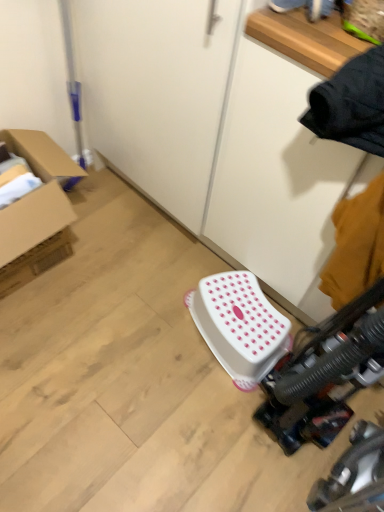
Question: Is white plastic stool at center at the back of cardboard box at left?

Choices:
 (A) yes
 (B) no

Answer: (B)

Question: Is the surface of cardboard box at left in direct contact with white plastic stool at center?

Choices:
 (A) no
 (B) yes

Answer: (A)

Question: Would you say white plastic stool at center is part of cardboard box at left's contents?

Choices:
 (A) yes
 (B) no

Answer: (B)

Question: Is cardboard box at left further to camera compared to white plastic stool at center?

Choices:
 (A) no
 (B) yes

Answer: (A)

Question: From a real-world perspective, is cardboard box at left physically above white plastic stool at center?

Choices:
 (A) no
 (B) yes

Answer: (B)

Question: Considering the relative positions of cardboard box at left and white plastic stool at center in the image provided, is cardboard box at left to the left of white plastic stool at center from the viewer's perspective?

Choices:
 (A) no
 (B) yes

Answer: (B)

Question: Would you say white plastic stool at center is outside cardboard box at left?

Choices:
 (A) no
 (B) yes

Answer: (B)

Question: Could you tell me if white plastic stool at center is facing cardboard box at left?

Choices:
 (A) yes
 (B) no

Answer: (B)

Question: Is white plastic stool at center directly adjacent to cardboard box at left?

Choices:
 (A) no
 (B) yes

Answer: (A)

Question: From a real-world perspective, is white plastic stool at center beneath cardboard box at left?

Choices:
 (A) no
 (B) yes

Answer: (B)

Question: Is white plastic stool at center oriented away from cardboard box at left?

Choices:
 (A) yes
 (B) no

Answer: (B)

Question: From a real-world perspective, is white plastic stool at center located higher than cardboard box at left?

Choices:
 (A) no
 (B) yes

Answer: (A)

Question: Is cardboard box at left inside the boundaries of white plastic stool at center, or outside?

Choices:
 (A) outside
 (B) inside

Answer: (A)